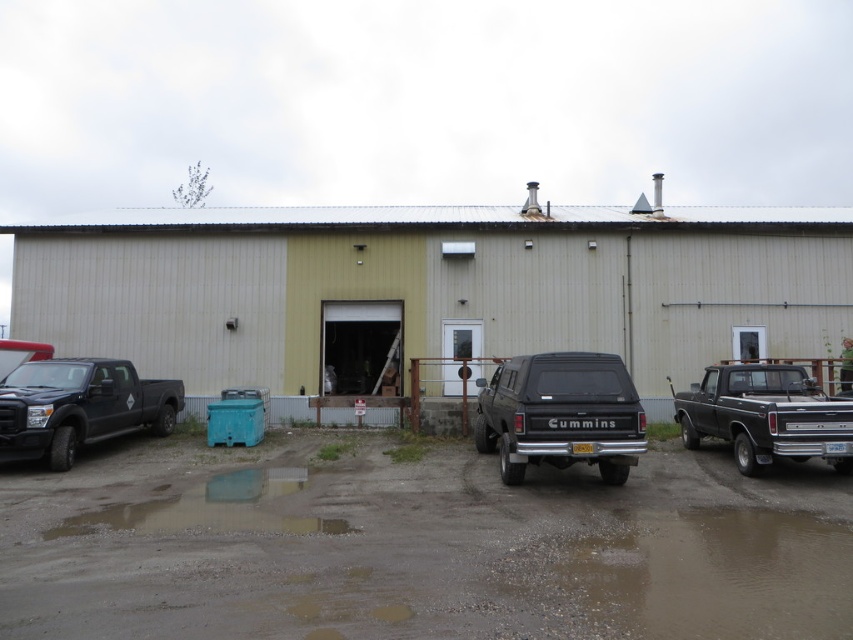
You are a delivery driver who needs to park your truck between the two trucks already parked in front of the building. Your truck is 2.5 meters wide. Can you safely park your truck between the matte black truck at left and the black matte truck at right without touching either?

The matte black truck at left has a lesser width compared to black matte truck at right. Since your truck is 2.5 meters wide, you need to check the space between them. If the space between the two trucks is wider than 2.5 meters, you can park safely. However, the description only states the left truck is narrower than the right one, but does not provide the exact distance between them. Without knowing the actual gap, it is impossible to determine if there is enough space.

You are standing at the entrance of the industrial building and want to locate the matte black truck at left. According to the coordinates provided, in which direction should you look to find it?

The matte black truck at left is located at coordinates point (79, 406), so you should look to the left side of the building to find it.